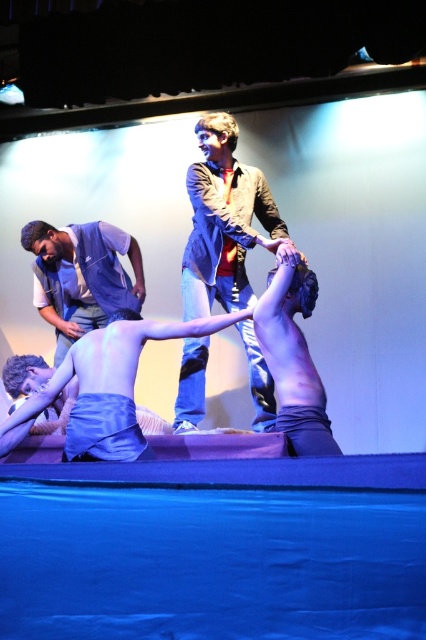
You are a stagehand standing at the edge of the stage floor. You need to retrieve the denim jacket at upper center, which is placed on a stand. The stage is 3 meters wide. Can you reach the jacket without stepping onto the stage floor?

The denim jacket at upper center is 3.33 meters away from the camera, which is beyond the 3 meter width of the stage floor. Therefore, you cannot reach it without stepping onto the stage floor.

You are a stagehand preparing to place a 2m wide curtain behind the performers. Given the smooth skin torso at center and the denim vest at left, which object is wider and should you consider when ensuring the curtain covers the entire stage area?

The smooth skin torso at center is wider than the denim vest at left. When placing the 2m wide curtain, ensure it extends beyond the width of the smooth skin torso at center to cover the entire stage area.

You are a stagehand preparing to move a 1.2 meter tall prop from the left side of the stage to the right. You need to pass between the smooth skin torso at center and the denim vest at left. Is there enough vertical space for the prop to pass through without hitting either object?

The smooth skin torso at center is shorter than the denim vest at left. Since the prop is 1.2 meters tall, it must clear the taller object, which is the denim vest at left. However, without knowing the exact height of the denim vest at left, we cannot confirm if the prop will fit. Additional measurements are needed.